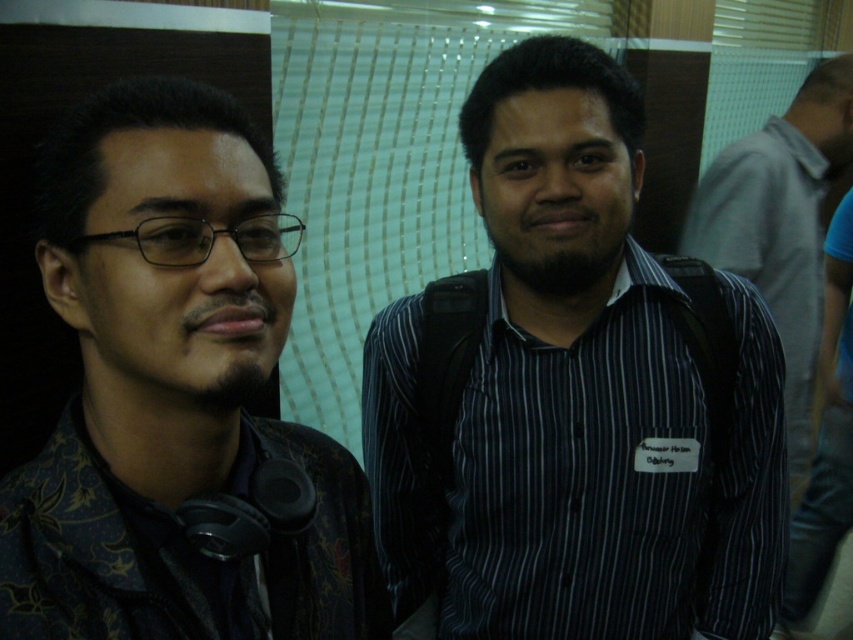
Looking at this image, does dark striped shirt at center appear over striped shirt at center?

No, dark striped shirt at center is not above striped shirt at center.

This screenshot has height=640, width=853. What do you see at coordinates (575, 397) in the screenshot? I see `dark striped shirt at center` at bounding box center [575, 397].

Where is `dark striped shirt at center`? This screenshot has height=640, width=853. dark striped shirt at center is located at coordinates (575, 397).

Is dark striped shirt at center to the right of matte black headphones at left from the viewer's perspective?

Correct, you'll find dark striped shirt at center to the right of matte black headphones at left.

Which is behind, point (392, 570) or point (277, 305)?

Positioned behind is point (392, 570).

Identify the location of dark striped shirt at center. This screenshot has width=853, height=640. (575, 397).

Measure the distance from matte black headphones at left to striped shirt at center.

matte black headphones at left and striped shirt at center are 5.24 feet apart.

Locate an element on the screen. matte black headphones at left is located at coordinates (173, 392).

Is point (80, 556) more distant than point (787, 276)?

No, it is in front of (787, 276).

Identify the location of matte black headphones at left. This screenshot has height=640, width=853. (173, 392).